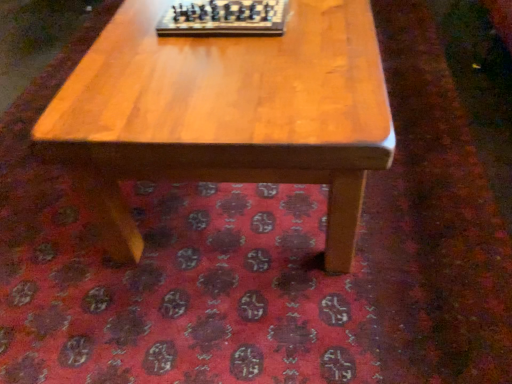
Where is `blank space to the left of wooden chessboard at center`? The width and height of the screenshot is (512, 384). blank space to the left of wooden chessboard at center is located at coordinates (x=126, y=38).